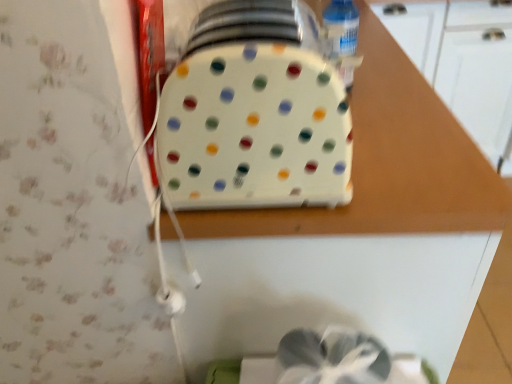
Locate an element on the screen. This screenshot has width=512, height=384. vacant space to the right of white plastic toaster at center is located at coordinates (407, 150).